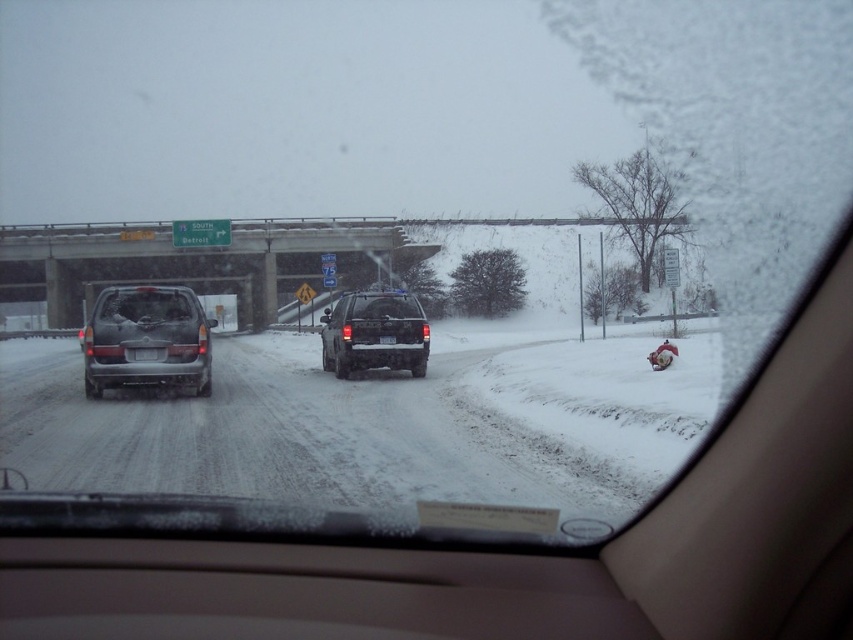
Who is more forward, (279, 275) or (381, 339)?

Positioned in front is point (381, 339).

You are a GUI agent. You are given a task and a screenshot of the screen. Output one action in this format:
    pyautogui.click(x=<x>, y=<y>)
    Task: Click on the concrete bridge at center
    The width and height of the screenshot is (853, 640).
    Given the screenshot: What is the action you would take?
    pyautogui.click(x=256, y=259)

Is point (146, 365) positioned after point (144, 355)?

That is False.

From the picture: Is smokey gray suv at left wider than black plastic license plate at rear?

Indeed, smokey gray suv at left has a greater width compared to black plastic license plate at rear.

Who is more distant from viewer, (x=119, y=365) or (x=155, y=356)?

The point (x=155, y=356) is more distant.

Identify the location of smokey gray suv at left. (148, 339).

Does concrete bridge at center have a smaller size compared to smokey gray suv at left?

Incorrect, concrete bridge at center is not smaller in size than smokey gray suv at left.

Is point (242, 248) closer to viewer compared to point (96, 396)?

No, (242, 248) is further to viewer.

Identify the location of concrete bridge at center. Image resolution: width=853 pixels, height=640 pixels. (256, 259).